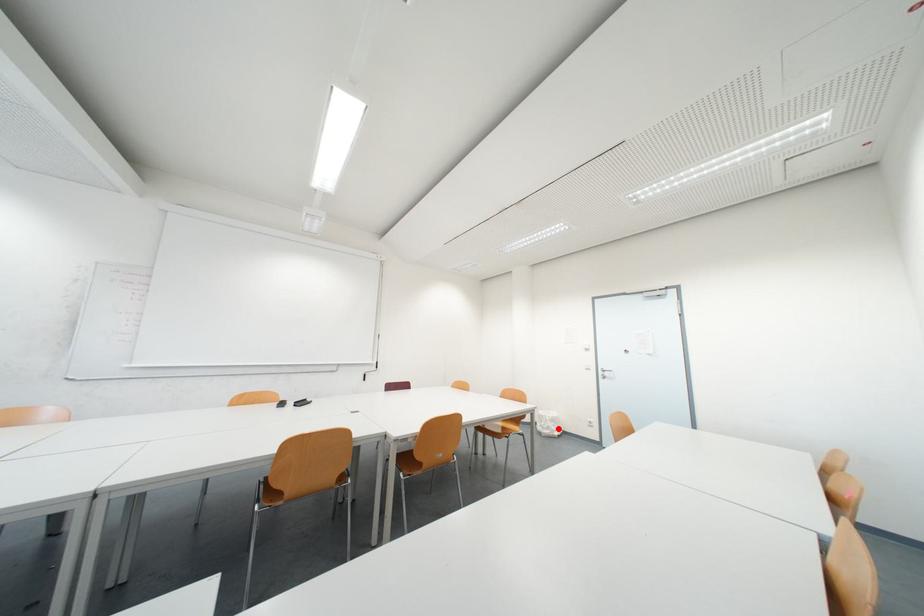
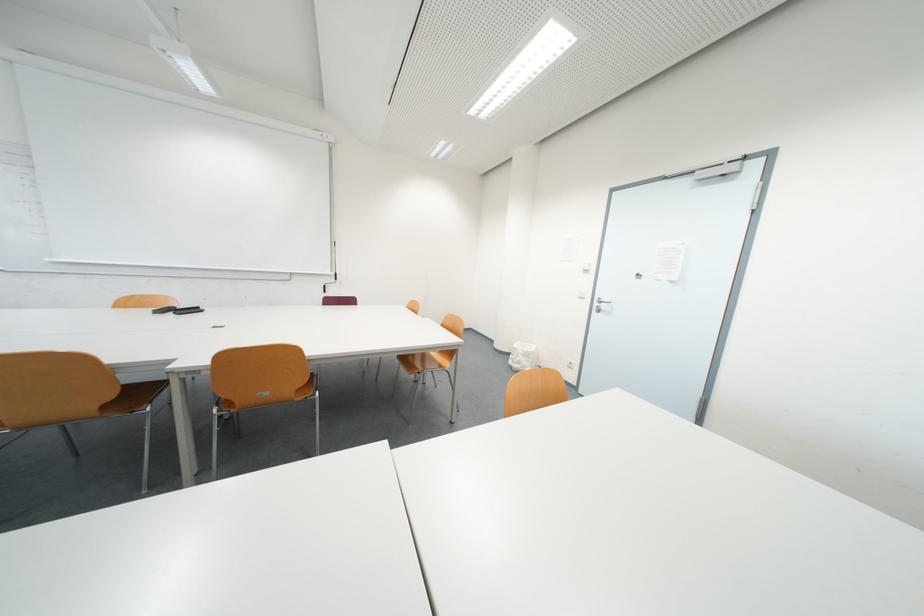
Question: I am providing you with two images of the same scene from different viewpoints. In image1, a red point is highlighted. Considering the same 3D point in image2, which of the following is correct?

Choices:
 (A) It is closer
 (B) It is farther

Answer: (A)